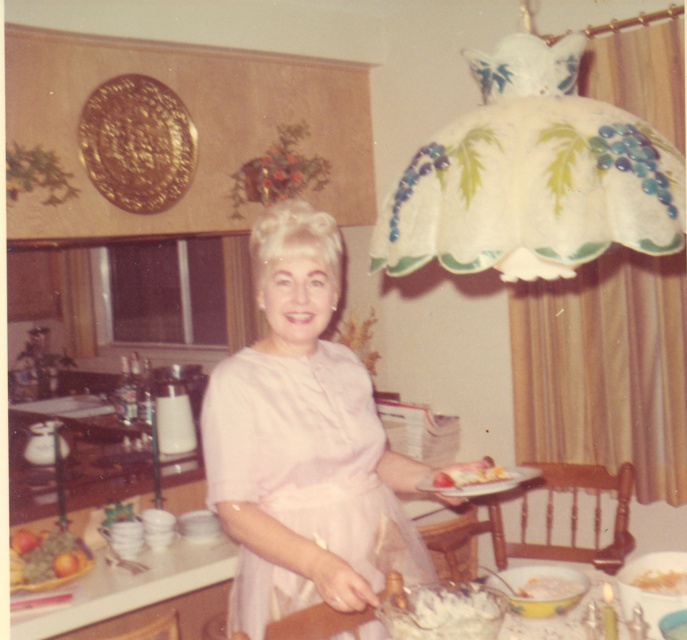
Question: Which point is farther to the camera?

Choices:
 (A) pink satin dress at center
 (B) white fluffy cake at lower center
 (C) white creamy dessert at lower center

Answer: (C)

Question: Which object is the closest to the pink satin dress at center?

Choices:
 (A) white creamy dessert at lower center
 (B) smooth white cake at lower right
 (C) white porcelain plate at lower right

Answer: (C)

Question: Is white fluffy cake at lower center thinner than white porcelain plate at lower right?

Choices:
 (A) yes
 (B) no

Answer: (A)

Question: Which object is farther from the camera taking this photo?

Choices:
 (A) shiny metallic fruit bowl at lower left
 (B) white porcelain plate at lower right
 (C) white fluffy bread at lower right

Answer: (A)

Question: Does white creamy dessert at lower center come behind white fluffy bread at lower right?

Choices:
 (A) yes
 (B) no

Answer: (A)

Question: Does pink satin dress at center have a lesser width compared to smooth white cake at lower right?

Choices:
 (A) yes
 (B) no

Answer: (B)